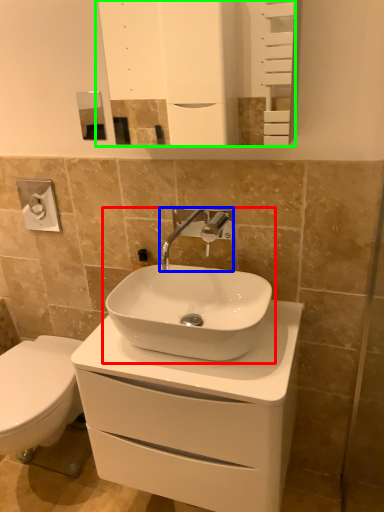
Question: Which object is positioned farthest from sink (highlighted by a red box)? Select from tap (highlighted by a blue box) and mirror (highlighted by a green box).

Choices:
 (A) tap
 (B) mirror

Answer: (B)